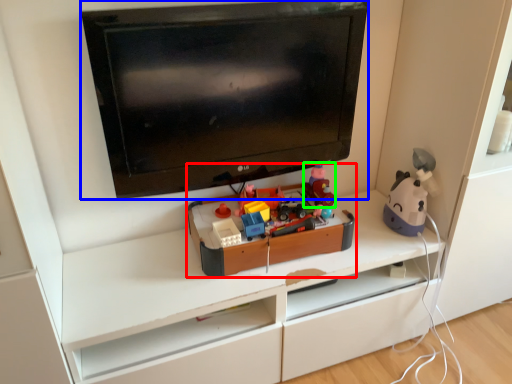
Question: Which object is positioned farthest from toy (highlighted by a red box)? Select from television (highlighted by a blue box) and toy (highlighted by a green box).

Choices:
 (A) television
 (B) toy

Answer: (A)